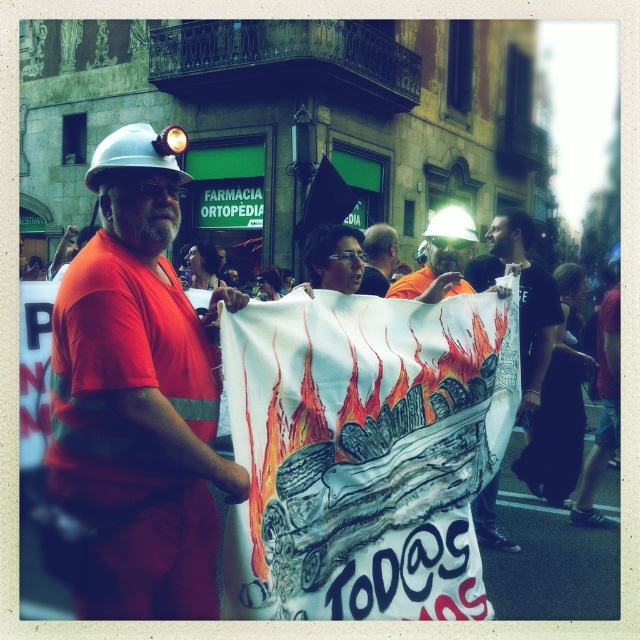
Is matte orange jumpsuit at center above orange reflective shirt at center?

Actually, matte orange jumpsuit at center is below orange reflective shirt at center.

Which is above, matte orange jumpsuit at center or orange reflective shirt at center?

orange reflective shirt at center

Is point (58, 352) closer to viewer compared to point (360, 292)?

Yes, point (58, 352) is closer to viewer.

The width and height of the screenshot is (640, 640). What are the coordinates of `matte orange jumpsuit at center` in the screenshot? It's located at (134, 404).

Can you confirm if matte white helmet at center is taller than matte black glasses at center?

Correct, matte white helmet at center is much taller as matte black glasses at center.

The image size is (640, 640). Describe the element at coordinates (440, 259) in the screenshot. I see `matte white helmet at center` at that location.

Which is in front, point (440, 275) or point (317, 285)?

Point (317, 285) is more forward.

Find the location of `matte white helmet at center`. matte white helmet at center is located at coordinates (440, 259).

Is point (474, 284) less distant than point (307, 252)?

No, (474, 284) is further to viewer.

This screenshot has width=640, height=640. What do you see at coordinates (528, 300) in the screenshot?
I see `black t-shirt at center` at bounding box center [528, 300].

Identify the location of black t-shirt at center. The width and height of the screenshot is (640, 640). (528, 300).